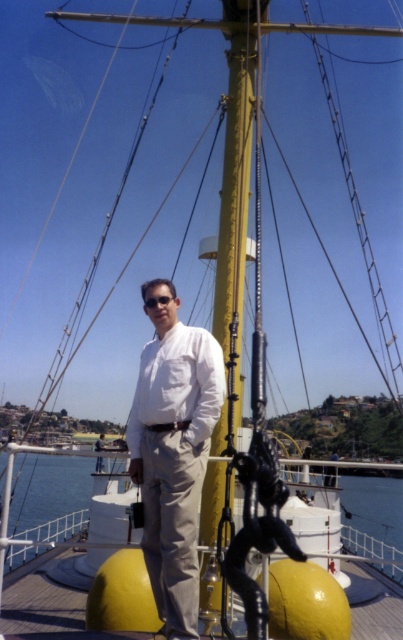
You are a sailor on the ship deck. You notice the transparent water at lower center and the white matte shirt at center. Which object appears taller from your viewpoint?

The transparent water at lower center appears much taller than the white matte shirt at center from your viewpoint.

From the picture: You are standing on the deck of a ship and want to reach a specific point marked as point (141, 416). If your current position is 10 feet away from the camera, can you walk directly to that point without moving closer than 5 feet to the camera?

The distance of point (141, 416) from the camera is 24.45 feet. Since your current position is 10 feet away from the camera, moving towards the point would require moving further away from the camera, so you can walk directly to that point without coming closer than 5 feet to the camera.